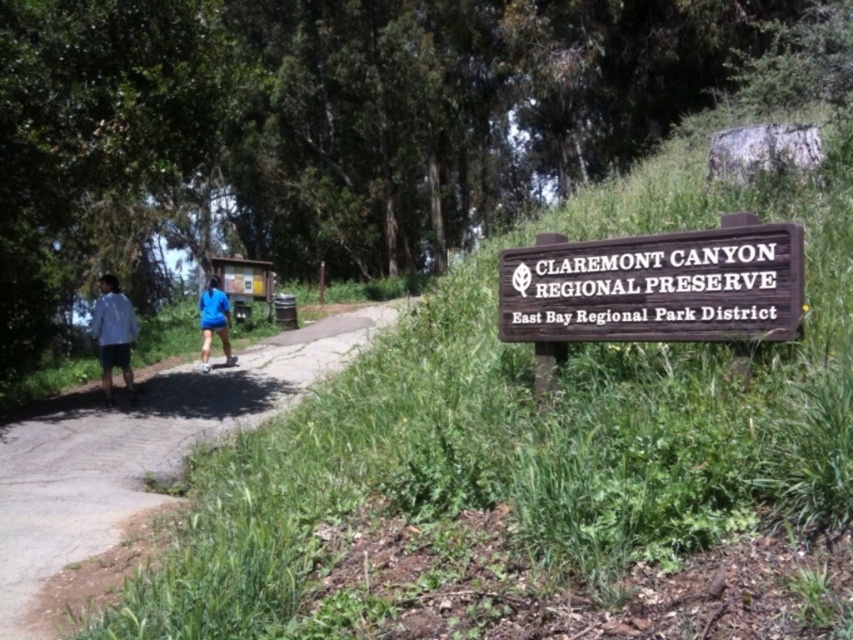
In the scene shown: Can you confirm if brown wooden sign at center is shorter than blue fabric shorts at center?

Indeed, brown wooden sign at center has a lesser height compared to blue fabric shorts at center.

Which is in front, point (546, 250) or point (218, 328)?

Positioned in front is point (546, 250).

At what (x,y) coordinates should I click in order to perform the action: click on brown wooden sign at center. Please return your answer as a coordinate pair (x, y). This screenshot has height=640, width=853. Looking at the image, I should click on (656, 285).

Who is more forward, (x=91, y=451) or (x=210, y=333)?

Positioned in front is point (x=91, y=451).

Which is above, gravel path at center or blue fabric shorts at center?

blue fabric shorts at center

Between point (97, 508) and point (225, 314), which one is positioned behind?

Positioned behind is point (225, 314).

Find the location of `gravel path at center`. gravel path at center is located at coordinates (140, 454).

Is blue fabric jacket at left smaller than blue fabric shorts at center?

No.

Does blue fabric jacket at left have a greater height compared to blue fabric shorts at center?

Yes.

At what (x,y) coordinates should I click in order to perform the action: click on blue fabric jacket at left. Please return your answer as a coordinate pair (x, y). Looking at the image, I should click on (113, 333).

You are a GUI agent. You are given a task and a screenshot of the screen. Output one action in this format:
    pyautogui.click(x=<x>, y=<y>)
    Task: Click on the blue fabric jacket at left
    This screenshot has height=640, width=853.
    Given the screenshot: What is the action you would take?
    pyautogui.click(x=113, y=333)